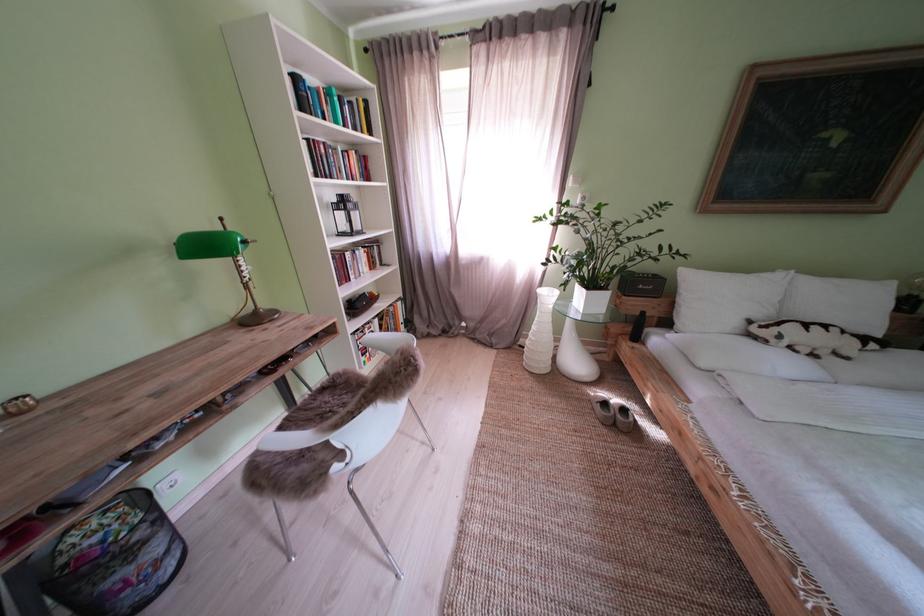
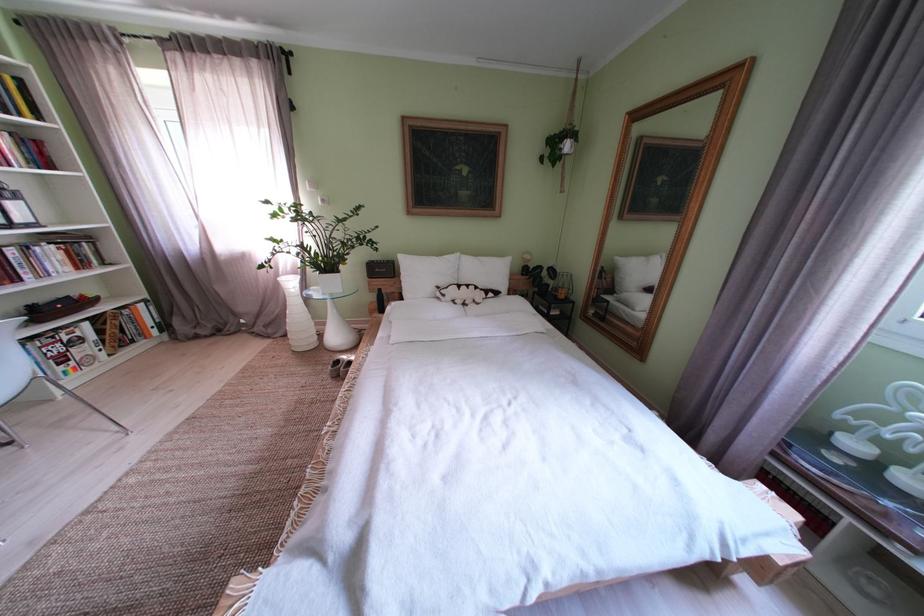
The images are taken continuously from a first-person perspective. In which direction are you moving?

The cameraman walked toward right, backward.